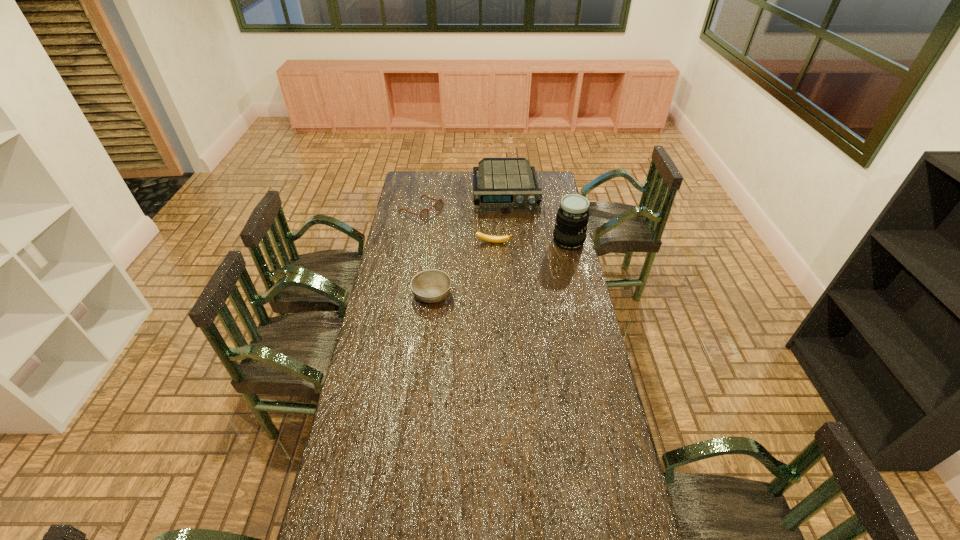
Where is `the nearest object`? This screenshot has width=960, height=540. the nearest object is located at coordinates (431, 286).

The image size is (960, 540). In order to click on the rightmost object in this screenshot , I will do pyautogui.click(x=572, y=218).

At what (x,y) coordinates should I click in order to perform the action: click on telephoto lens. Please return your answer as a coordinate pair (x, y). This screenshot has width=960, height=540. Looking at the image, I should click on (572, 218).

I want to click on the fourth shortest object, so coord(506,185).

In order to click on spectacles in this screenshot , I will do tap(424, 213).

This screenshot has height=540, width=960. In order to click on banana in this screenshot , I will do `click(494, 239)`.

You are a GUI agent. You are given a task and a screenshot of the screen. Output one action in this format:
    pyautogui.click(x=<x>, y=<y>)
    Task: Click on the vacant area situated 0.170m on the back of the bowl
    Image resolution: width=960 pixels, height=540 pixels.
    Given the screenshot: What is the action you would take?
    pyautogui.click(x=436, y=256)

Identify the location of free space located on the left of the telephoto lens. The image size is (960, 540). point(473,241).

I want to click on vacant space located 0.250m on the front panel of the fourth shortest object, so click(x=511, y=243).

Find the location of a particular element. vacant space situated 0.310m on the front panel of the fourth shortest object is located at coordinates (512, 251).